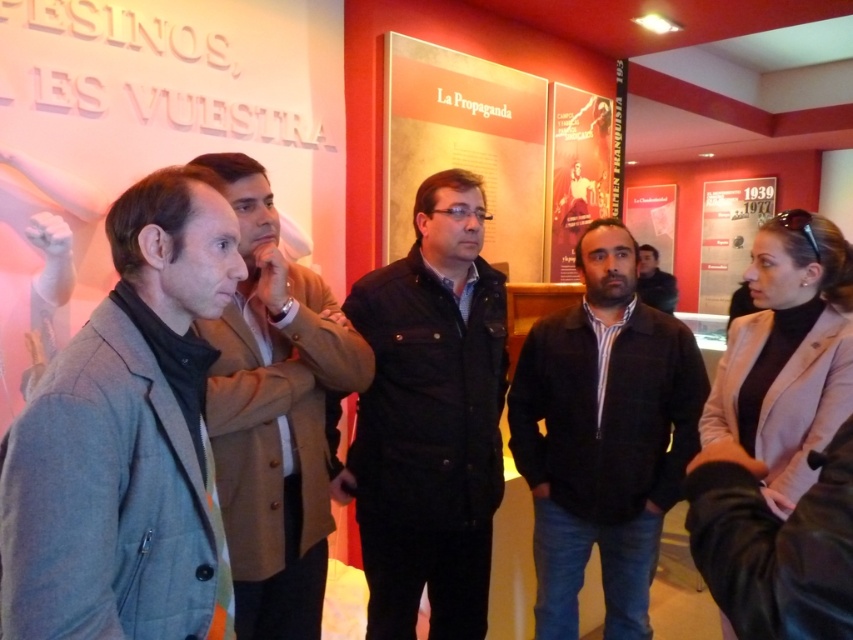
Question: Which point appears farthest from the camera in this image?

Choices:
 (A) (711, 268)
 (B) (643, 257)

Answer: (A)

Question: Does matte paper poster at upper center have a larger size compared to matte red poster at upper right?

Choices:
 (A) yes
 (B) no

Answer: (B)

Question: Does light brown leather jacket at left lie in front of matte red poster at upper right?

Choices:
 (A) yes
 (B) no

Answer: (A)

Question: Which object appears farthest from the camera in this image?

Choices:
 (A) matte paper poster at center
 (B) gray woolen coat at left
 (C) matte black jacket at center

Answer: (C)

Question: Is matte red poster at upper right closer to camera compared to matte white poster at upper right?

Choices:
 (A) no
 (B) yes

Answer: (B)

Question: Which point is closer to the camera taking this photo?

Choices:
 (A) (550, 260)
 (B) (643, 196)

Answer: (A)